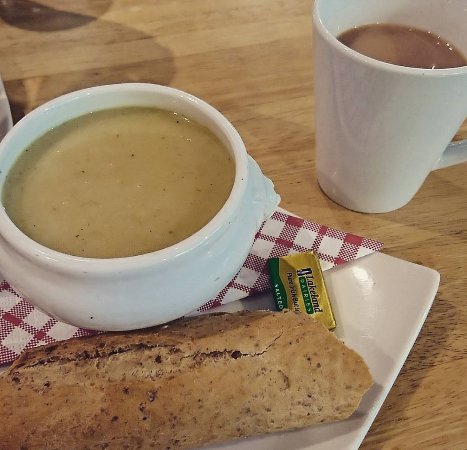
This screenshot has height=450, width=467. I want to click on handle, so click(x=459, y=157).